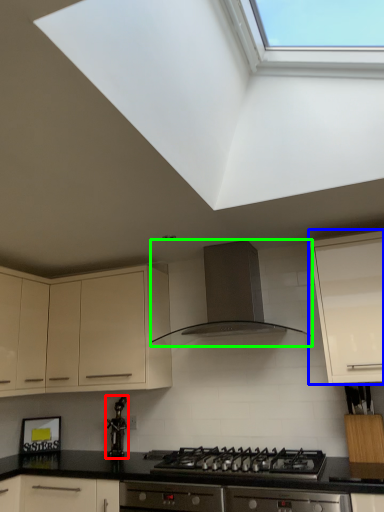
Question: Estimate the real-world distances between objects in this image. Which object is farther from appliance (highlighted by a red box), cabinetry (highlighted by a blue box) or kitchen appliance (highlighted by a green box)?

Choices:
 (A) cabinetry
 (B) kitchen appliance

Answer: (A)